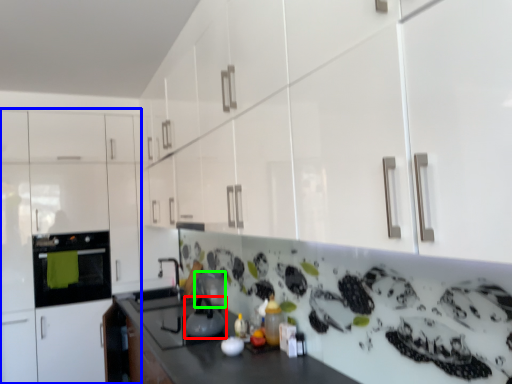
Question: Based on their relative distances, which object is farther from kitchen appliance (highlighted by a red box)? Choose from cabinetry (highlighted by a blue box) and appliance (highlighted by a green box).

Choices:
 (A) cabinetry
 (B) appliance

Answer: (A)